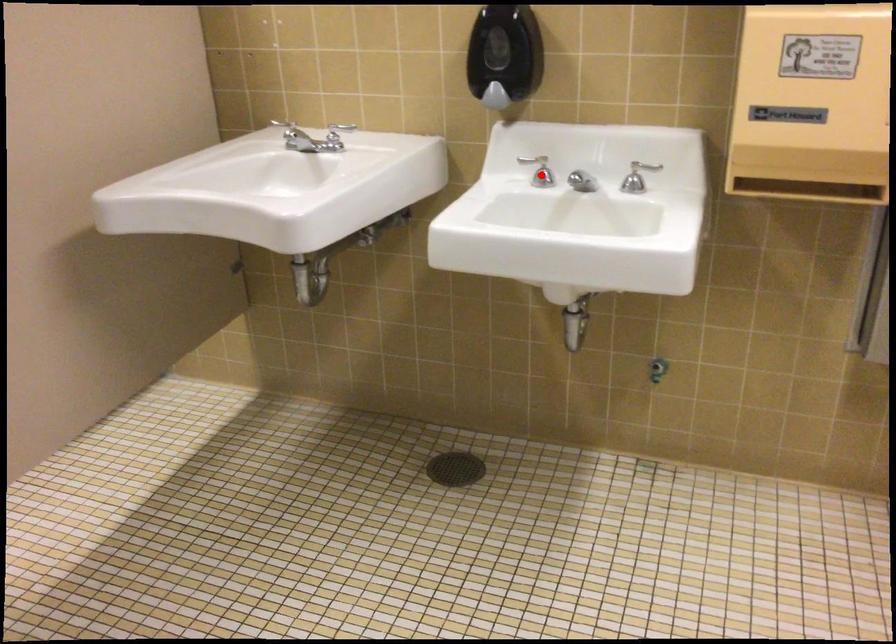
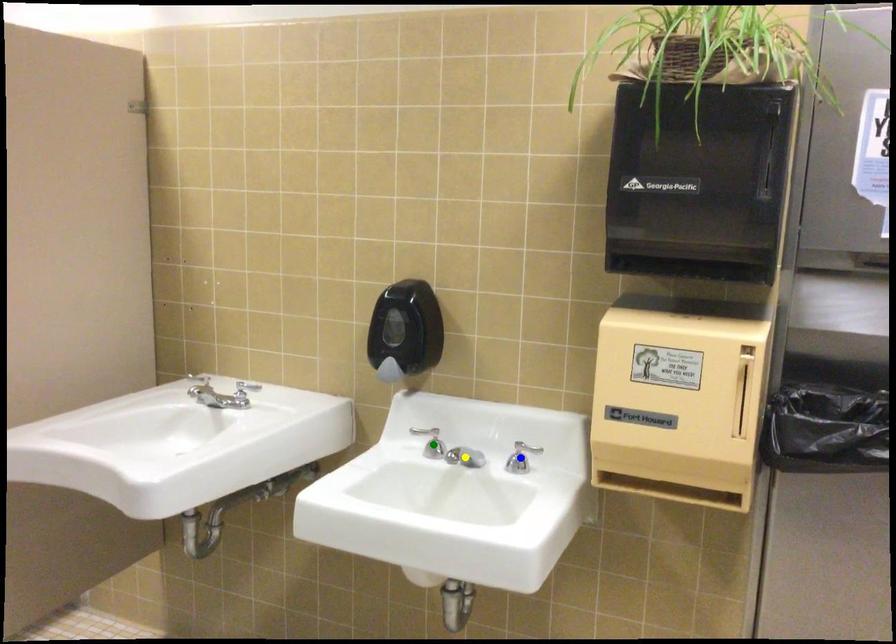
Question: I am providing you with two images of the same scene from different viewpoints. A red point is marked on the first image. You are given multiple points on the second image. Which point in image 2 represents the same 3d spot as the red point in image 1?

Choices:
 (A) green point
 (B) yellow point
 (C) blue point

Answer: (A)